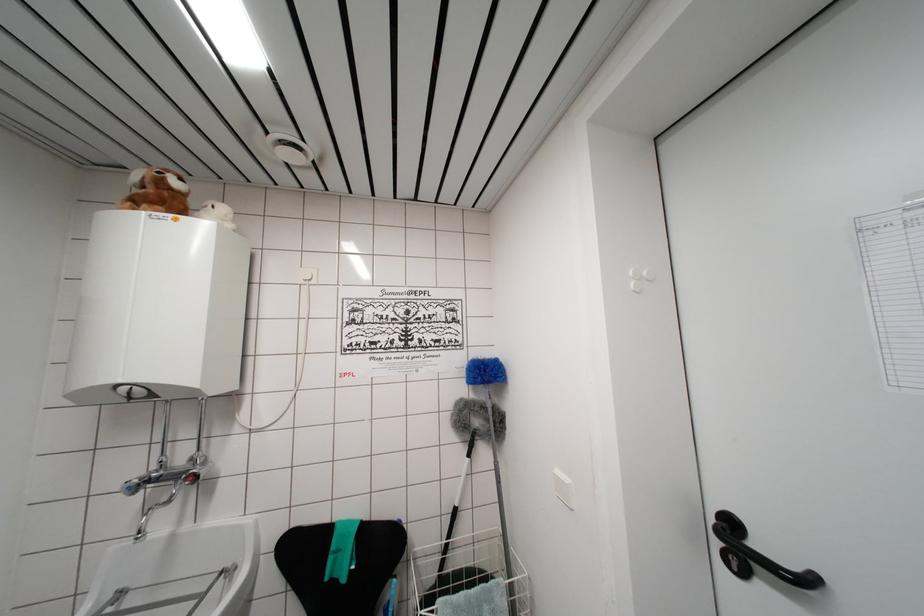
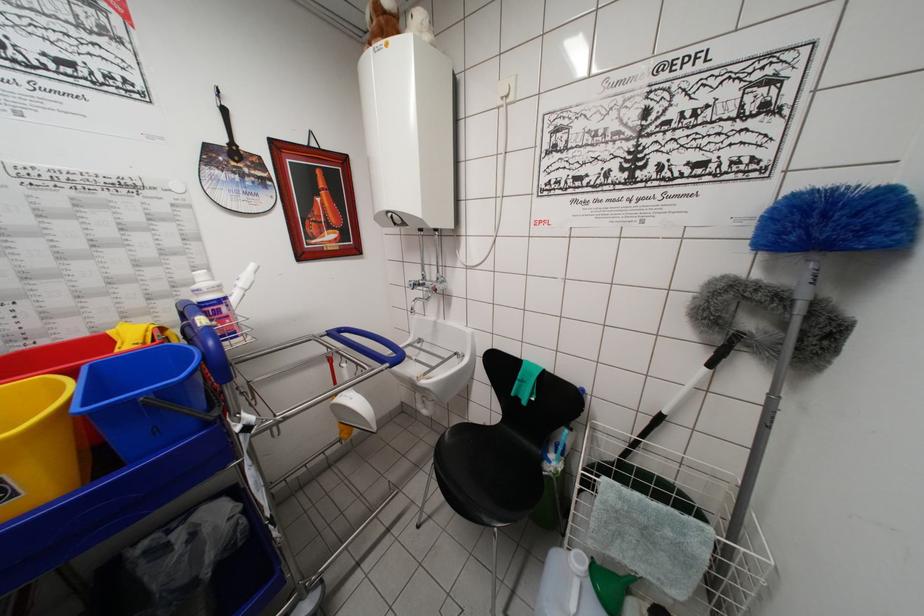
Locate, in the second image, the point that corresponds to (x=484, y=371) in the first image.

(821, 209)